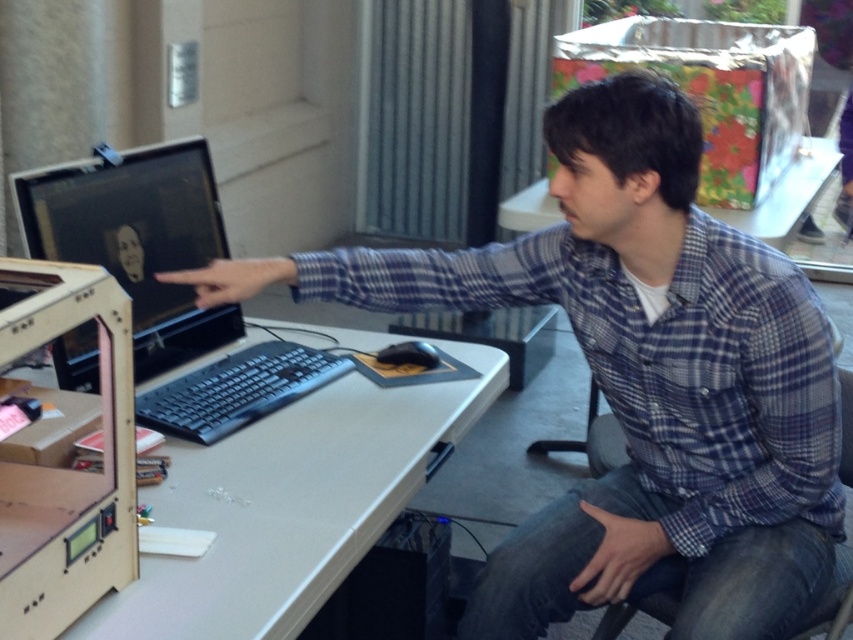
Question: Can you confirm if white matte computer desk at center is smaller than black plastic keyboard at center?

Choices:
 (A) no
 (B) yes

Answer: (A)

Question: Which point is farther from the camera taking this photo?

Choices:
 (A) (30, 316)
 (B) (630, 320)
 (C) (167, 224)
 (D) (300, 348)

Answer: (D)

Question: Which object is farther from the camera taking this photo?

Choices:
 (A) matte black monitor at left
 (B) plaid shirt at center
 (C) white matte computer desk at center

Answer: (A)

Question: Can you confirm if wooden/plastic 3d printer at lower left is positioned below matte black monitor at left?

Choices:
 (A) yes
 (B) no

Answer: (A)

Question: Which object is closer to the camera taking this photo?

Choices:
 (A) matte black monitor at left
 (B) white matte computer desk at center
 (C) wooden/plastic 3d printer at lower left
 (D) black plastic keyboard at center

Answer: (C)

Question: In this image, where is wooden/plastic 3d printer at lower left located relative to black plastic keyboard at center?

Choices:
 (A) below
 (B) above

Answer: (A)